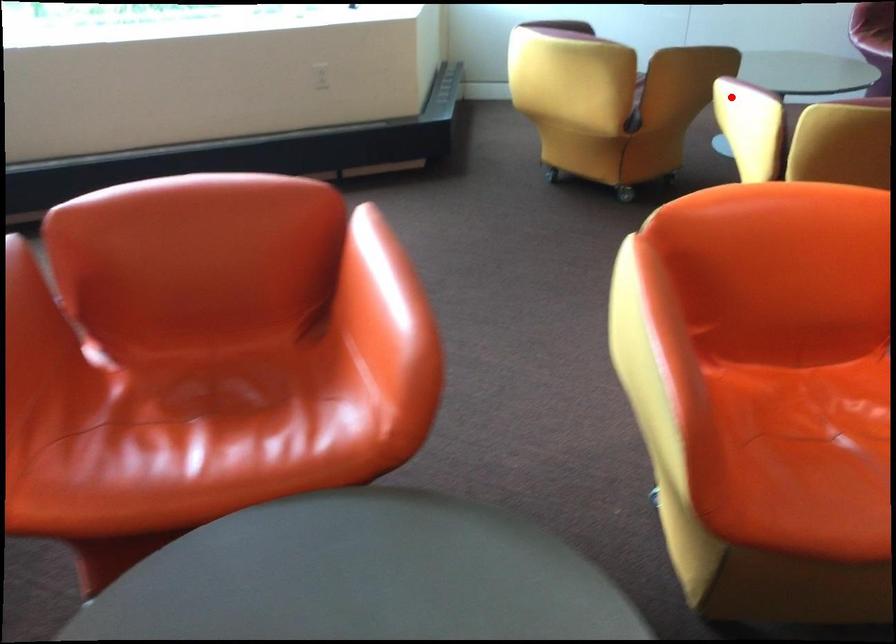
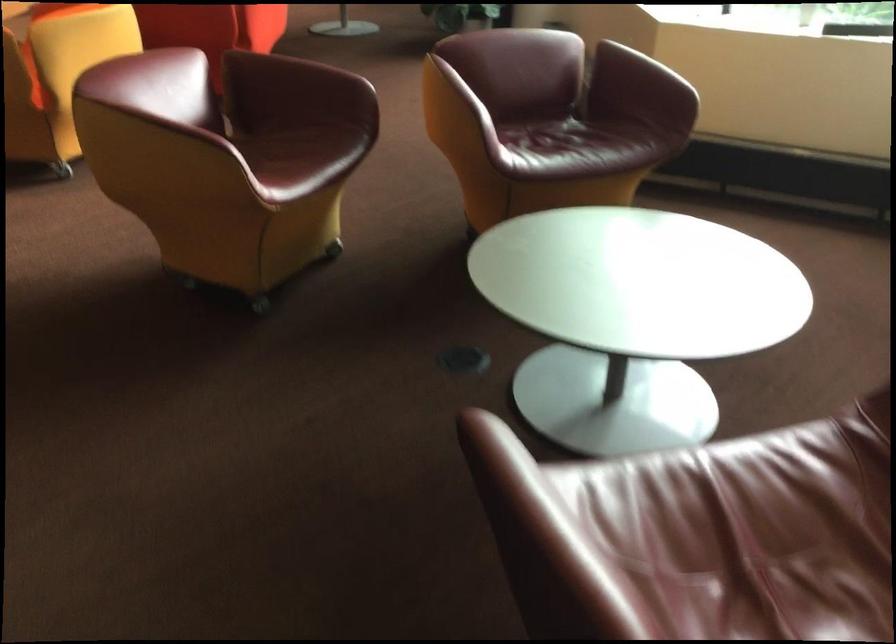
The point at the highlighted location is marked in the first image. Where is the corresponding point in the second image?

(291, 75)